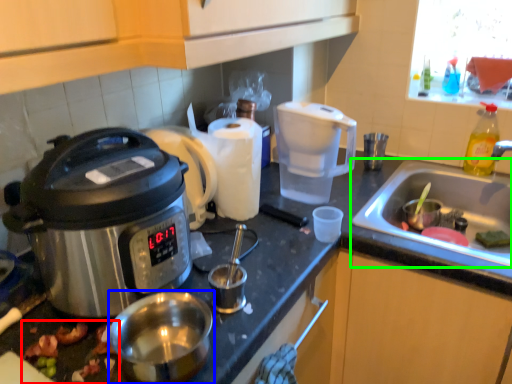
Question: Which object is the closest to the food (highlighted by a red box)? Choose among these: appliance (highlighted by a blue box) or sink (highlighted by a green box).

Choices:
 (A) appliance
 (B) sink

Answer: (A)